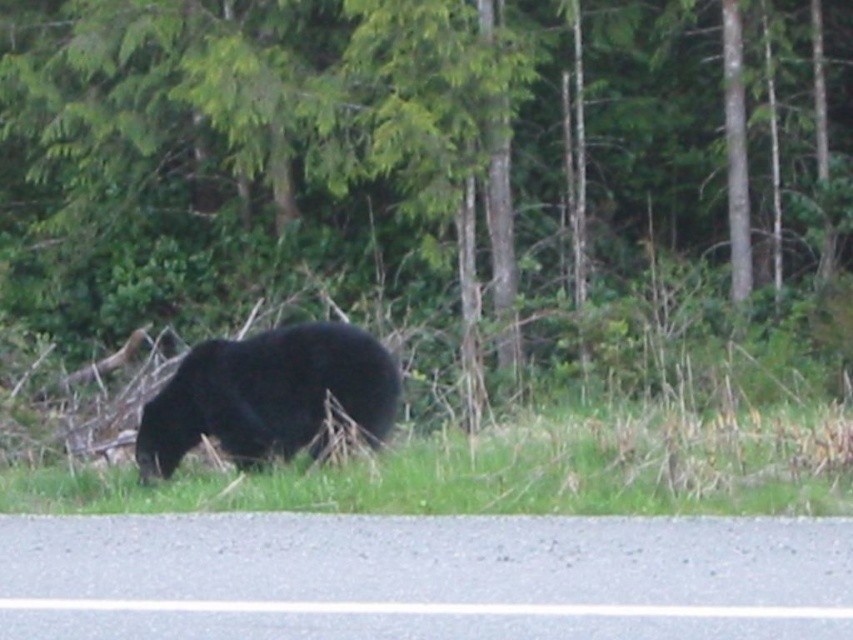
What do you see at coordinates (403, 148) in the screenshot?
I see `green leafy tree at center` at bounding box center [403, 148].

What are the coordinates of `green leafy tree at center` in the screenshot? It's located at (403, 148).

Is green grass at lower center further to camera compared to black furry bear at center?

No, it is not.

Which is behind, point (593, 497) or point (171, 403)?

Positioned behind is point (171, 403).

Is point (567, 419) positioned in front of point (370, 394)?

No.

Locate an element on the screen. green grass at lower center is located at coordinates (511, 470).

Can you confirm if green leafy tree at center is positioned above black furry bear at center?

Yes.

Who is higher up, green leafy tree at center or black furry bear at center?

green leafy tree at center is above.

Who is more forward, (204, 65) or (189, 397)?

Point (189, 397)

Identify the location of green leafy tree at center. [x=403, y=148].